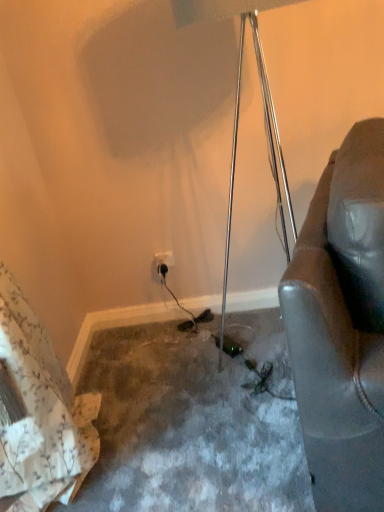
This screenshot has height=512, width=384. Identify the location of metallic tripod at center. (239, 102).

Describe the element at coordinates (239, 102) in the screenshot. I see `metallic tripod at center` at that location.

Locate an element on the screen. The image size is (384, 512). metallic tripod at center is located at coordinates (239, 102).